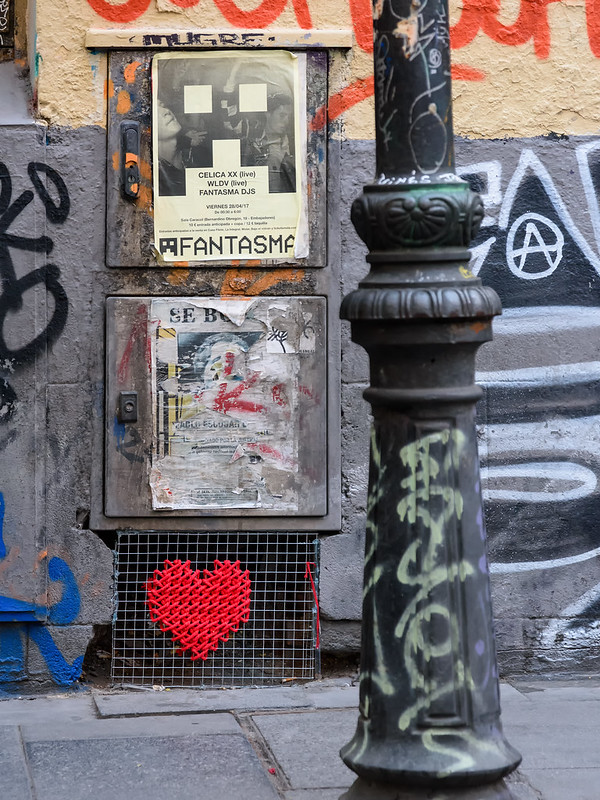
Find the location of a particular element. This screenshot has width=600, height=800. bottom door is located at coordinates (133, 485).